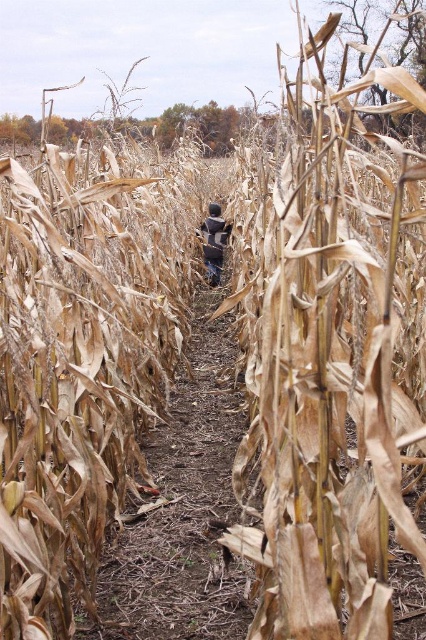
Measure the distance between point (331,241) and camera.

Point (331,241) is 6.13 feet away from camera.

Locate an element on the screen. This screenshot has height=640, width=426. brown dried corn at center is located at coordinates (331, 353).

Who is more forward, [291,618] or [210,209]?

Point [291,618] is more forward.

This screenshot has height=640, width=426. I want to click on brown dried corn at center, so click(x=331, y=353).